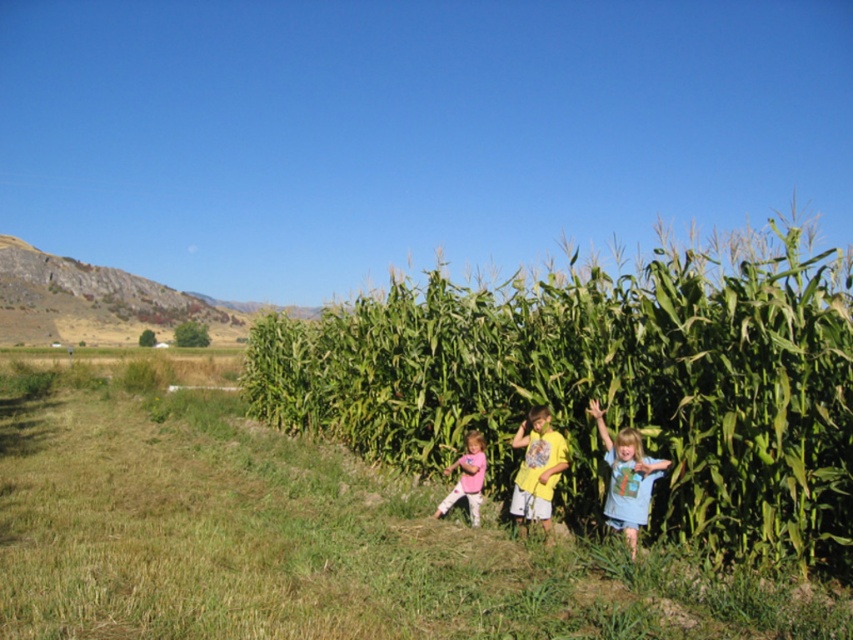
Question: Is green leafy corn at center positioned at the back of yellow cotton shirt at center?

Choices:
 (A) no
 (B) yes

Answer: (A)

Question: Based on their relative distances, which object is farther from the green leafy corn at center?

Choices:
 (A) pink fabric shirt at lower center
 (B) blue cotton shirt at right
 (C) green grass at lower center
 (D) yellow cotton shirt at center

Answer: (A)

Question: Which of the following is the farthest from the observer?

Choices:
 (A) blue cotton shirt at right
 (B) pink fabric shirt at lower center
 (C) green grass at lower center

Answer: (B)

Question: Where is blue cotton shirt at right located in relation to yellow cotton shirt at center in the image?

Choices:
 (A) above
 (B) below

Answer: (A)

Question: Which of the following is the closest to the observer?

Choices:
 (A) (612, 451)
 (B) (515, 486)
 (C) (476, 483)
 (D) (390, 611)

Answer: (D)

Question: Does blue cotton shirt at right lie in front of yellow cotton shirt at center?

Choices:
 (A) no
 (B) yes

Answer: (B)